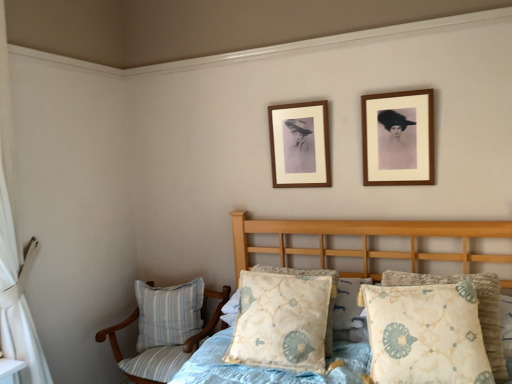
How much space does blue striped pillow at lower left, acting as the third pillow starting from the right, occupy vertically?

blue striped pillow at lower left, acting as the third pillow starting from the right, is 18.74 inches tall.

At what (x,y) coordinates should I click in order to perform the action: click on blue striped pillow at lower left, the 3th pillow when ordered from front to back. Please return your answer as a coordinate pair (x, y). This screenshot has height=384, width=512. Looking at the image, I should click on (168, 313).

What is the approximate height of wooden picture frame at upper right, positioned as the 1th picture frame in front-to-back order?

wooden picture frame at upper right, positioned as the 1th picture frame in front-to-back order, is 18.16 inches tall.

You are a GUI agent. You are given a task and a screenshot of the screen. Output one action in this format:
    pyautogui.click(x=<x>, y=<y>)
    Task: Click on the matte brown picture frame at center, the second picture frame positioned from the right
    
    Given the screenshot: What is the action you would take?
    pyautogui.click(x=300, y=144)

Describe the element at coordinates (162, 345) in the screenshot. I see `striped fabric chair at lower left` at that location.

What is the approximate height of striped fabric chair at lower left?

striped fabric chair at lower left is 30.54 inches in height.

What do you see at coordinates (282, 321) in the screenshot?
I see `floral-patterned fabric pillow at center, the second pillow positioned from the left` at bounding box center [282, 321].

The height and width of the screenshot is (384, 512). Describe the element at coordinates (366, 239) in the screenshot. I see `fluffy fabric bed at lower right` at that location.

The width and height of the screenshot is (512, 384). I want to click on blue striped pillow at lower left, the 3th pillow when ordered from front to back, so click(168, 313).

Does floral-patterned fabric pillow at center, acting as the first pillow starting from the right, have a lesser width compared to matte brown picture frame at center, the second picture frame viewed from the front?

In fact, floral-patterned fabric pillow at center, acting as the first pillow starting from the right, might be wider than matte brown picture frame at center, the second picture frame viewed from the front.

Is floral-patterned fabric pillow at center, arranged as the third pillow when viewed from the back, completely or partially outside of matte brown picture frame at center, the second picture frame positioned from the right?

floral-patterned fabric pillow at center, arranged as the third pillow when viewed from the back, lies outside matte brown picture frame at center, the second picture frame positioned from the right,'s area.

Considering the positions of objects matte brown picture frame at center, acting as the first picture frame starting from the left, and wooden picture frame at upper right, positioned as the 1th picture frame in front-to-back order, in the image provided, who is in front, matte brown picture frame at center, acting as the first picture frame starting from the left, or wooden picture frame at upper right, positioned as the 1th picture frame in front-to-back order,?

wooden picture frame at upper right, positioned as the 1th picture frame in front-to-back order, is in front.

Considering the sizes of objects matte brown picture frame at center, the second picture frame positioned from the right, and wooden picture frame at upper right, placed as the second picture frame when sorted from back to front, in the image provided, who is bigger, matte brown picture frame at center, the second picture frame positioned from the right, or wooden picture frame at upper right, placed as the second picture frame when sorted from back to front,?

wooden picture frame at upper right, placed as the second picture frame when sorted from back to front.

Considering the relative sizes of matte brown picture frame at center, the second picture frame positioned from the right, and wooden picture frame at upper right, the 1th picture frame when ordered from right to left, in the image provided, is matte brown picture frame at center, the second picture frame positioned from the right, thinner than wooden picture frame at upper right, the 1th picture frame when ordered from right to left,?

Yes.

Can you see matte brown picture frame at center, the 1th picture frame positioned from the back, touching wooden picture frame at upper right, positioned as the 1th picture frame in front-to-back order?

No.

Choose the correct answer: Is blue striped pillow at lower left, the 1th pillow when ordered from left to right, inside wooden picture frame at upper right, the 1th picture frame when ordered from right to left, or outside it?

blue striped pillow at lower left, the 1th pillow when ordered from left to right, exists outside the volume of wooden picture frame at upper right, the 1th picture frame when ordered from right to left.

Find the location of a particular element. the 1st picture frame positioned above the blue striped pillow at lower left, acting as the third pillow starting from the right (from a real-world perspective) is located at coordinates (398, 138).

From the image's perspective, is blue striped pillow at lower left, the 1th pillow when ordered from left to right, located above or below wooden picture frame at upper right, which is the second picture frame from left to right?

Clearly, from the image's perspective, blue striped pillow at lower left, the 1th pillow when ordered from left to right, is below wooden picture frame at upper right, which is the second picture frame from left to right.

From their relative heights in the image, would you say striped fabric chair at lower left is taller or shorter than matte brown picture frame at center, the second picture frame viewed from the front?

striped fabric chair at lower left is taller than matte brown picture frame at center, the second picture frame viewed from the front.

Is striped fabric chair at lower left oriented away from matte brown picture frame at center, the second picture frame viewed from the front?

No, striped fabric chair at lower left is not facing the opposite direction of matte brown picture frame at center, the second picture frame viewed from the front.

Is striped fabric chair at lower left at the left side of matte brown picture frame at center, the second picture frame viewed from the front?

Correct, you'll find striped fabric chair at lower left to the left of matte brown picture frame at center, the second picture frame viewed from the front.

From a real-world perspective, which object stands above the other?

wooden picture frame at upper right, placed as the second picture frame when sorted from back to front, is physically above.

Who is bigger, fluffy fabric bed at lower right or wooden picture frame at upper right, the 1th picture frame when ordered from right to left?

With larger size is fluffy fabric bed at lower right.

Which object is further away from the camera, fluffy fabric bed at lower right or wooden picture frame at upper right, placed as the second picture frame when sorted from back to front?

wooden picture frame at upper right, placed as the second picture frame when sorted from back to front, is further away from the camera.

Considering the relative positions of fluffy fabric bed at lower right and wooden picture frame at upper right, the 1th picture frame when ordered from right to left, in the image provided, is fluffy fabric bed at lower right to the left of wooden picture frame at upper right, the 1th picture frame when ordered from right to left, from the viewer's perspective?

Yes, fluffy fabric bed at lower right is to the left of wooden picture frame at upper right, the 1th picture frame when ordered from right to left.

From a real-world perspective, which object rests below the other?

In real-world perspective, striped fabric chair at lower left is lower.

How different are the orientations of striped fabric chair at lower left and blue striped pillow at lower left, acting as the first pillow starting from the back, in degrees?

striped fabric chair at lower left and blue striped pillow at lower left, acting as the first pillow starting from the back, are facing 2.85 degrees away from each other.

Considering the relative positions of striped fabric chair at lower left and blue striped pillow at lower left, the 3th pillow when ordered from front to back, in the image provided, is striped fabric chair at lower left to the left or to the right of blue striped pillow at lower left, the 3th pillow when ordered from front to back,?

striped fabric chair at lower left is positioned on blue striped pillow at lower left, the 3th pillow when ordered from front to back,'s right side.

Who is more distant, striped fabric chair at lower left or blue striped pillow at lower left, the 1th pillow when ordered from left to right?

blue striped pillow at lower left, the 1th pillow when ordered from left to right, is further from the camera.

Is floral-patterned fabric pillow at center, which appears as the first pillow when viewed from the front, with floral-patterned fabric pillow at center, acting as the second pillow starting from the right?

No.

In the scene shown: Is floral-patterned fabric pillow at center, acting as the second pillow starting from the right, completely or partially inside floral-patterned fabric pillow at center, which appears as the first pillow when viewed from the front?

No, floral-patterned fabric pillow at center, which appears as the first pillow when viewed from the front, does not contain floral-patterned fabric pillow at center, acting as the second pillow starting from the right.

Which object is further away from the camera taking this photo, floral-patterned fabric pillow at center, which is the third pillow in left-to-right order, or floral-patterned fabric pillow at center, the second pillow positioned from the left?

floral-patterned fabric pillow at center, the second pillow positioned from the left, is further from the camera.

Looking at their sizes, would you say floral-patterned fabric pillow at center, arranged as the third pillow when viewed from the back, is wider or thinner than floral-patterned fabric pillow at center, the second pillow positioned from the left?

Clearly, floral-patterned fabric pillow at center, arranged as the third pillow when viewed from the back, has less width compared to floral-patterned fabric pillow at center, the second pillow positioned from the left.

This screenshot has height=384, width=512. I want to click on the 2nd picture frame positioned above the floral-patterned fabric pillow at center, which is the third pillow in left-to-right order (from a real-world perspective), so click(x=300, y=144).

The width and height of the screenshot is (512, 384). In order to click on picture frame that is above the matte brown picture frame at center, the second picture frame positioned from the right (from the image's perspective) in this screenshot , I will do `click(398, 138)`.

Based on their spatial positions, is fluffy fabric bed at lower right or floral-patterned fabric pillow at center, acting as the first pillow starting from the right, closer to wooden picture frame at upper right, the 1th picture frame when ordered from right to left?

Based on the image, fluffy fabric bed at lower right appears to be nearer to wooden picture frame at upper right, the 1th picture frame when ordered from right to left.

Based on the photo, considering their positions, is fluffy fabric bed at lower right positioned closer to striped fabric chair at lower left than floral-patterned fabric pillow at center, which appears as the first pillow when viewed from the front?

The object closer to striped fabric chair at lower left is fluffy fabric bed at lower right.

From the image, which object appears to be farther from floral-patterned fabric pillow at center, arranged as the third pillow when viewed from the back, striped fabric chair at lower left or wooden picture frame at upper right, positioned as the 1th picture frame in front-to-back order?

striped fabric chair at lower left lies further to floral-patterned fabric pillow at center, arranged as the third pillow when viewed from the back, than the other object.

Which object lies further to the anchor point fluffy fabric bed at lower right, blue striped pillow at lower left, acting as the first pillow starting from the back, or wooden picture frame at upper right, positioned as the 1th picture frame in front-to-back order?

The object further to fluffy fabric bed at lower right is blue striped pillow at lower left, acting as the first pillow starting from the back.

Based on their spatial positions, is fluffy fabric bed at lower right or wooden picture frame at upper right, positioned as the 1th picture frame in front-to-back order, closer to striped fabric chair at lower left?

fluffy fabric bed at lower right is closer to striped fabric chair at lower left.

Considering their positions, is striped fabric chair at lower left positioned closer to floral-patterned fabric pillow at center, acting as the second pillow starting from the right, than wooden picture frame at upper right, which is the second picture frame from left to right?

striped fabric chair at lower left.

When comparing their distances from striped fabric chair at lower left, does blue striped pillow at lower left, the 3th pillow when ordered from front to back, or wooden picture frame at upper right, which is the second picture frame from left to right, seem closer?

The object closer to striped fabric chair at lower left is blue striped pillow at lower left, the 3th pillow when ordered from front to back.

When comparing their distances from floral-patterned fabric pillow at center, which appears as the first pillow when viewed from the front, does wooden picture frame at upper right, which is the second picture frame from left to right, or striped fabric chair at lower left seem further?

Among the two, striped fabric chair at lower left is located further to floral-patterned fabric pillow at center, which appears as the first pillow when viewed from the front.

Where is `picture frame situated between blue striped pillow at lower left, the 3th pillow when ordered from front to back, and floral-patterned fabric pillow at center, which is the third pillow in left-to-right order, from left to right`? picture frame situated between blue striped pillow at lower left, the 3th pillow when ordered from front to back, and floral-patterned fabric pillow at center, which is the third pillow in left-to-right order, from left to right is located at coordinates (300, 144).

This screenshot has height=384, width=512. I want to click on chair situated between blue striped pillow at lower left, acting as the first pillow starting from the back, and floral-patterned fabric pillow at center, acting as the second pillow starting from the right, from left to right, so click(162, 345).

In order to click on pillow that lies between wooden picture frame at upper right, positioned as the 1th picture frame in front-to-back order, and floral-patterned fabric pillow at center, the second pillow in the back-to-front sequence, from top to bottom in this screenshot , I will do `click(478, 309)`.

The image size is (512, 384). I want to click on picture frame between fluffy fabric bed at lower right and matte brown picture frame at center, the second picture frame viewed from the front, from front to back, so click(x=398, y=138).